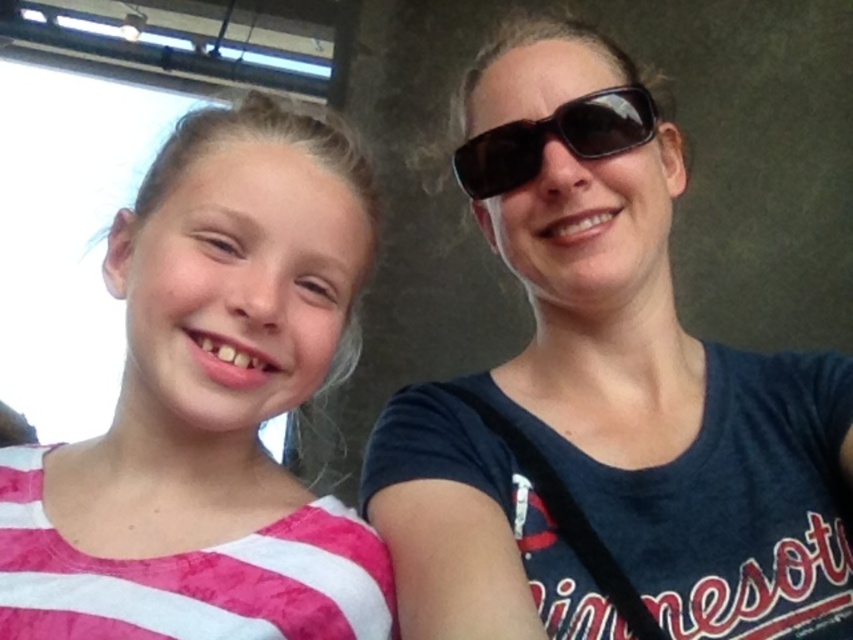
Can you confirm if matte black sunglasses at upper center is positioned to the right of black matte sunglasses at upper center?

Yes, matte black sunglasses at upper center is to the right of black matte sunglasses at upper center.

Is point (850, 493) farther from camera compared to point (647, 134)?

Yes, point (850, 493) is behind point (647, 134).

Which is in front, point (801, 577) or point (485, 145)?

Positioned in front is point (801, 577).

This screenshot has width=853, height=640. I want to click on matte black sunglasses at upper center, so click(608, 396).

Does pink striped shirt at left come behind black matte sunglasses at upper center?

No, it is in front of black matte sunglasses at upper center.

Who is more distant from viewer, (296, 621) or (526, 172)?

The point (526, 172) is more distant.

Where is `pink striped shirt at left`? Image resolution: width=853 pixels, height=640 pixels. pink striped shirt at left is located at coordinates (210, 406).

Is matte black sunglasses at upper center above pink striped shirt at left?

Correct, matte black sunglasses at upper center is located above pink striped shirt at left.

How far apart are matte black sunglasses at upper center and pink striped shirt at left?

matte black sunglasses at upper center and pink striped shirt at left are 16.99 centimeters apart from each other.

Which is in front, point (531, 81) or point (213, 358)?

Point (213, 358) is in front.

The image size is (853, 640). Identify the location of matte black sunglasses at upper center. (608, 396).